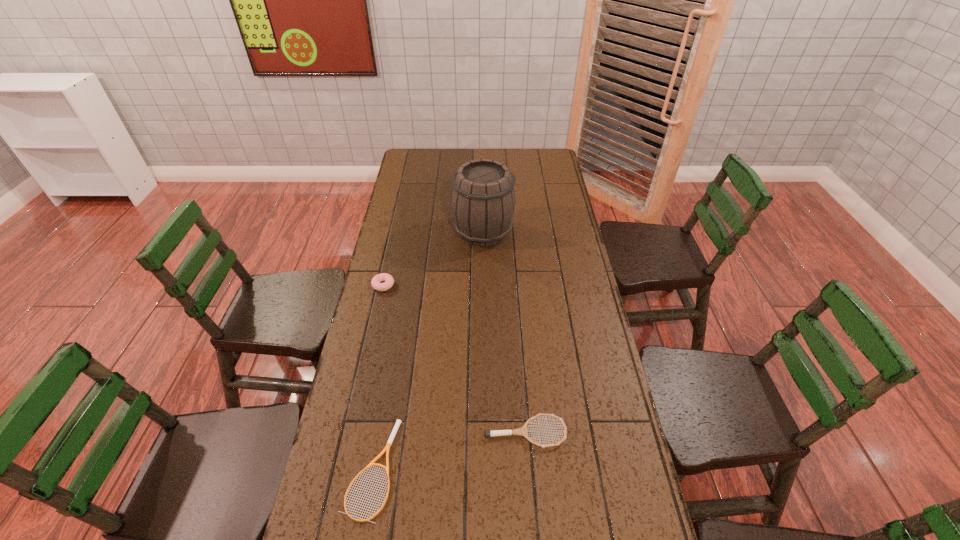
Identify the location of empty space that is in between the shorter tennis racket and the taller tennis racket. Image resolution: width=960 pixels, height=540 pixels. (449, 450).

What are the coordinates of `vacant area between the second farthest object and the right tennis racket` in the screenshot? It's located at (454, 359).

The image size is (960, 540). I want to click on empty space that is in between the taller tennis racket and the second tallest object, so click(454, 359).

Where is `vacant region between the second tallest object and the second shortest object`? The width and height of the screenshot is (960, 540). vacant region between the second tallest object and the second shortest object is located at coordinates (454, 359).

You are a GUI agent. You are given a task and a screenshot of the screen. Output one action in this format:
    pyautogui.click(x=<x>, y=<y>)
    Task: Click on the free space between the left tennis racket and the farthest object
    This screenshot has width=960, height=540.
    Given the screenshot: What is the action you would take?
    pyautogui.click(x=427, y=350)

Image resolution: width=960 pixels, height=540 pixels. Identify the location of vacant space that's between the wine bucket and the left tennis racket. (427, 350).

You are a GUI agent. You are given a task and a screenshot of the screen. Output one action in this format:
    pyautogui.click(x=<x>, y=<y>)
    Task: Click on the vacant space that is in between the shortest object and the right tennis racket
    Image resolution: width=960 pixels, height=540 pixels.
    Given the screenshot: What is the action you would take?
    pyautogui.click(x=449, y=450)

The image size is (960, 540). What are the coordinates of `free space between the shorter tennis racket and the farthest object` in the screenshot? It's located at (427, 350).

The image size is (960, 540). I want to click on free space between the tallest object and the shorter tennis racket, so click(427, 350).

Identify the location of vacant area that lies between the right tennis racket and the shorter tennis racket. (449, 450).